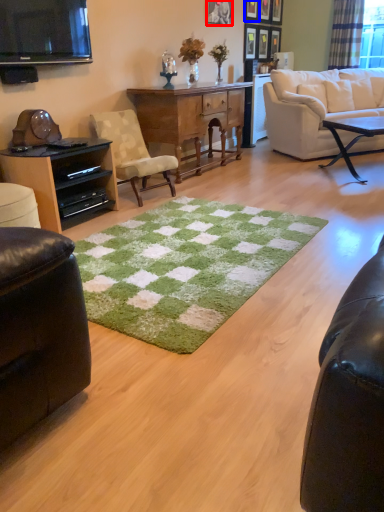
Question: Which point is closer to the camera, picture frame (highlighted by a red box) or picture frame (highlighted by a blue box)?

Choices:
 (A) picture frame
 (B) picture frame

Answer: (A)